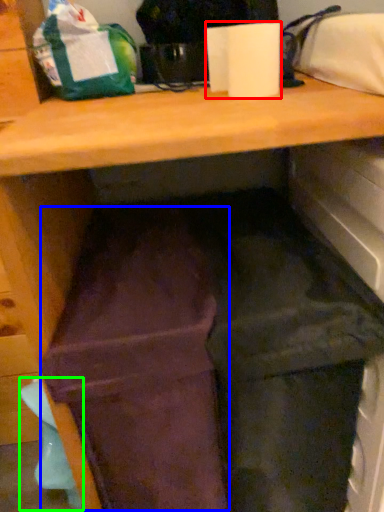
Question: Which object is positioned closest to paper towel (highlighted by a red box)? Select from wide (highlighted by a blue box) and waste (highlighted by a green box).

Choices:
 (A) wide
 (B) waste

Answer: (A)